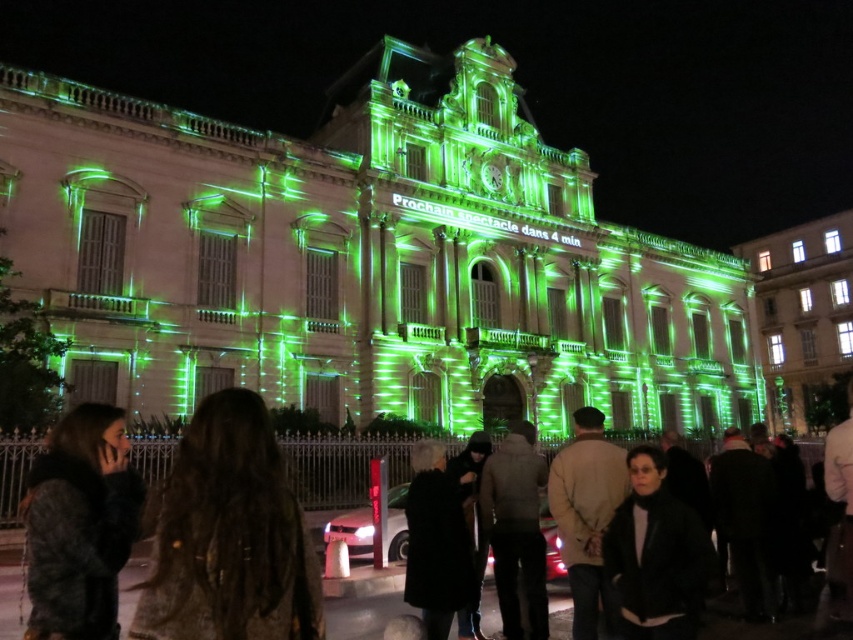
The height and width of the screenshot is (640, 853). What do you see at coordinates (229, 536) in the screenshot?
I see `dark brown leather jacket at lower left` at bounding box center [229, 536].

Does point (247, 476) come closer to viewer compared to point (553, 612)?

Yes, point (247, 476) is closer to viewer.

Locate an element on the screen. This screenshot has height=640, width=853. dark brown leather jacket at lower left is located at coordinates (229, 536).

In the scene shown: Is dark brown fur coat at lower left to the right of black leather jacket at center from the viewer's perspective?

Incorrect, dark brown fur coat at lower left is not on the right side of black leather jacket at center.

Does point (39, 518) lie in front of point (554, 593)?

Yes, it is.

Where is `dark brown fur coat at lower left`? Image resolution: width=853 pixels, height=640 pixels. dark brown fur coat at lower left is located at coordinates (80, 524).

Does dark brown leather jacket at lower left appear over dark brown fur coat at lower left?

No.

Which of these two, dark brown leather jacket at lower left or dark brown fur coat at lower left, stands shorter?

Standing shorter between the two is dark brown fur coat at lower left.

Which is in front, point (257, 460) or point (50, 625)?

Positioned in front is point (50, 625).

Identify the location of dark brown leather jacket at lower left. Image resolution: width=853 pixels, height=640 pixels. (229, 536).